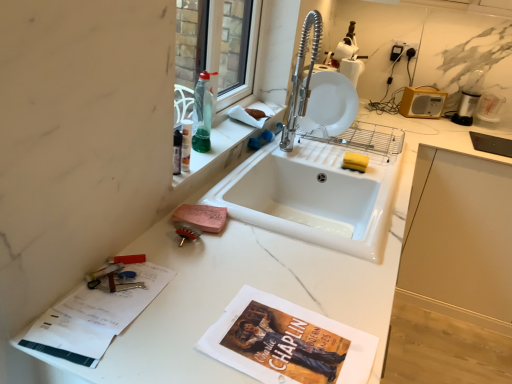
Question: Does white glossy plate at upper center have a lesser height compared to transparent glass window at upper center?

Choices:
 (A) yes
 (B) no

Answer: (A)

Question: Considering the relative positions of white glossy plate at upper center and transparent glass window at upper center in the image provided, is white glossy plate at upper center to the left of transparent glass window at upper center from the viewer's perspective?

Choices:
 (A) yes
 (B) no

Answer: (B)

Question: Is white glossy plate at upper center at the right side of transparent glass window at upper center?

Choices:
 (A) yes
 (B) no

Answer: (A)

Question: From a real-world perspective, is white glossy plate at upper center over transparent glass window at upper center?

Choices:
 (A) yes
 (B) no

Answer: (B)

Question: Considering the relative sizes of white glossy plate at upper center and transparent glass window at upper center in the image provided, is white glossy plate at upper center taller than transparent glass window at upper center?

Choices:
 (A) yes
 (B) no

Answer: (B)

Question: Does white glossy plate at upper center have a smaller size compared to transparent glass window at upper center?

Choices:
 (A) no
 (B) yes

Answer: (B)

Question: Is translucent green liquid at sink left smaller than white plastic radio at upper right?

Choices:
 (A) yes
 (B) no

Answer: (A)

Question: Is white plastic radio at upper right a part of translucent green liquid at sink left?

Choices:
 (A) yes
 (B) no

Answer: (B)

Question: Could you tell me if translucent green liquid at sink left is turned towards white plastic radio at upper right?

Choices:
 (A) no
 (B) yes

Answer: (A)

Question: Considering the relative sizes of translucent green liquid at sink left and white plastic radio at upper right in the image provided, is translucent green liquid at sink left shorter than white plastic radio at upper right?

Choices:
 (A) no
 (B) yes

Answer: (A)

Question: From a real-world perspective, is translucent green liquid at sink left physically below white plastic radio at upper right?

Choices:
 (A) yes
 (B) no

Answer: (B)

Question: Is translucent green liquid at sink left next to white plastic radio at upper right?

Choices:
 (A) no
 (B) yes

Answer: (A)

Question: Is transparent glass window at upper center oriented away from white plastic radio at upper right?

Choices:
 (A) yes
 (B) no

Answer: (B)